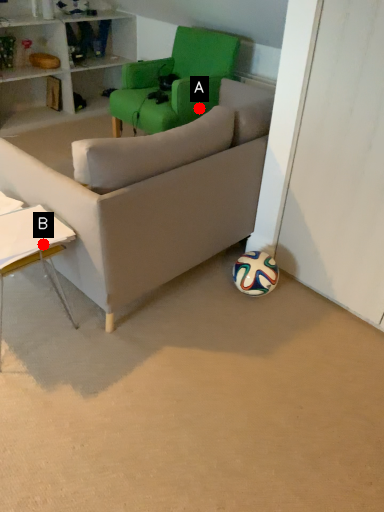
Question: Two points are circled on the image, labeled by A and B beside each circle. Which point is further to the camera?

Choices:
 (A) A is further
 (B) B is further

Answer: (A)